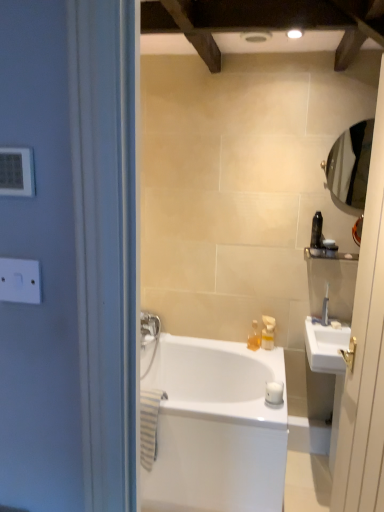
Question: Considering the positions of clear glass mirror at right and silver metallic mirror at upper right in the image, is clear glass mirror at right bigger or smaller than silver metallic mirror at upper right?

Choices:
 (A) small
 (B) big

Answer: (B)

Question: Is point (332, 500) positioned closer to the camera than point (350, 204)?

Choices:
 (A) closer
 (B) farther

Answer: (A)

Question: Estimate the real-world distances between objects in this image. Which object is closer to the white glossy bathtub at center?

Choices:
 (A) satin nickel faucet at upper right
 (B) white matte toilet paper at center
 (C) white plastic switch at upper left
 (D) clear glass mirror at right
 (E) translucent plastic bottles at upper center, the 3th toiletry positioned from the top

Answer: (B)

Question: Which is nearer to the white plastic light switch at upper left?

Choices:
 (A) satin nickel faucet at upper right
 (B) white glossy bathtub at center
 (C) white plastic switch at upper left
 (D) white matte toilet paper at center
 (E) black plastic toothbrush at right, the 2th toiletry viewed from the right

Answer: (C)